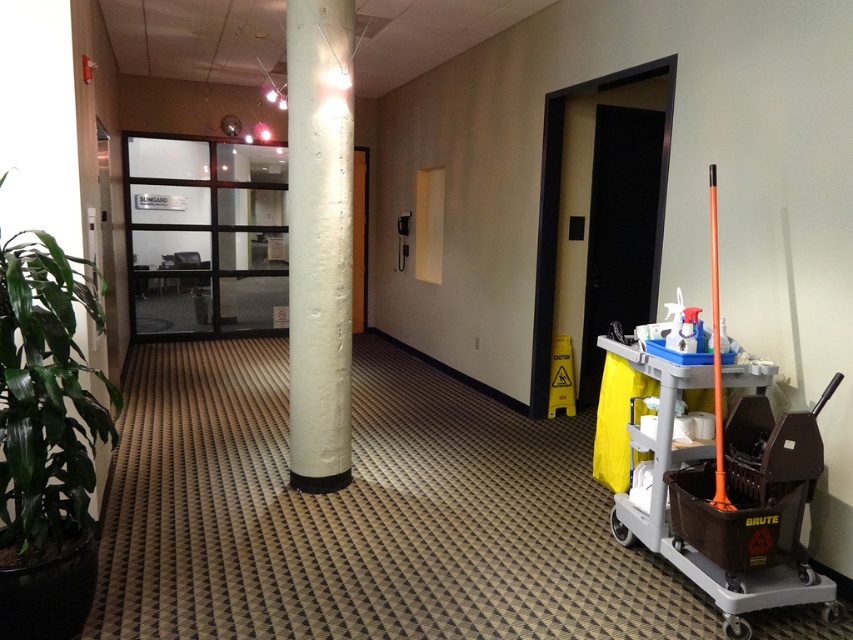
Does white textured column at center have a greater height compared to matte gray trolley at right?

Indeed, white textured column at center has a greater height compared to matte gray trolley at right.

Who is more forward, (311, 84) or (724, 627)?

Point (724, 627)

Is point (296, 180) positioned after point (685, 540)?

Yes, point (296, 180) is farther from viewer.

Image resolution: width=853 pixels, height=640 pixels. Identify the location of white textured column at center. (318, 241).

Is white textured column at center positioned at the back of green leafy plant at left?

That is True.

Who is shorter, white textured column at center or green leafy plant at left?

With less height is green leafy plant at left.

What do you see at coordinates (318, 241) in the screenshot? This screenshot has height=640, width=853. I see `white textured column at center` at bounding box center [318, 241].

Find the location of a particular element. The image size is (853, 640). white textured column at center is located at coordinates (318, 241).

The height and width of the screenshot is (640, 853). What are the coordinates of `white textured column at center` in the screenshot? It's located at pyautogui.click(x=318, y=241).

Locate an element on the screen. white textured column at center is located at coordinates (318, 241).

The image size is (853, 640). In order to click on white textured column at center in this screenshot , I will do `click(318, 241)`.